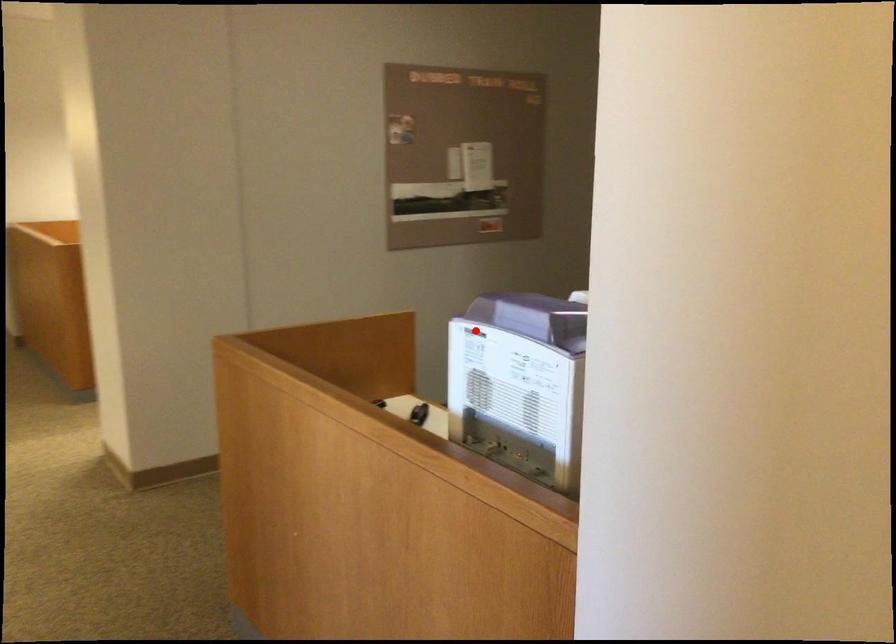
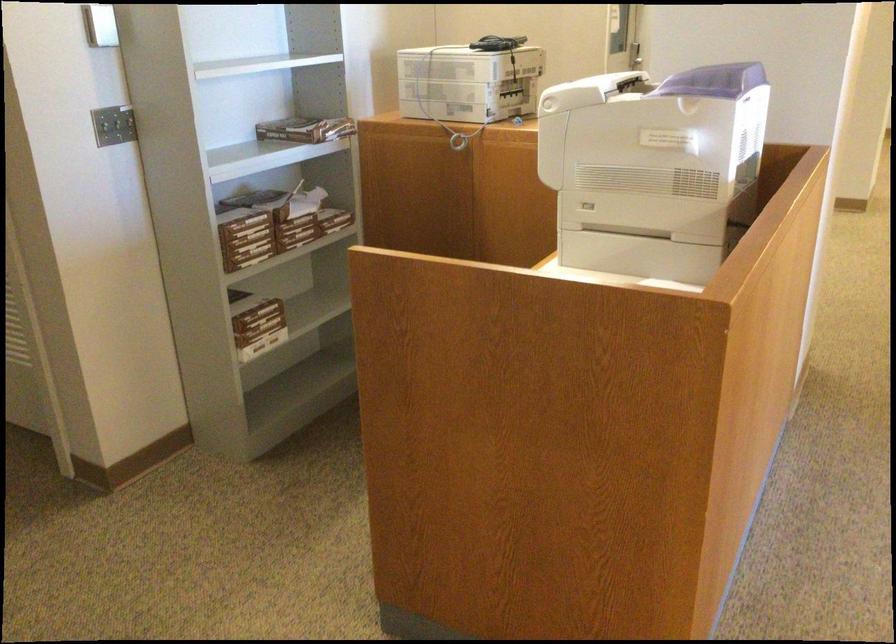
Question: I am providing you with two images of the same scene from different viewpoints. Given a red point in image1, look at the same physical point in image2. Is it:

Choices:
 (A) Closer to the viewpoint
 (B) Farther from the viewpoint

Answer: (B)